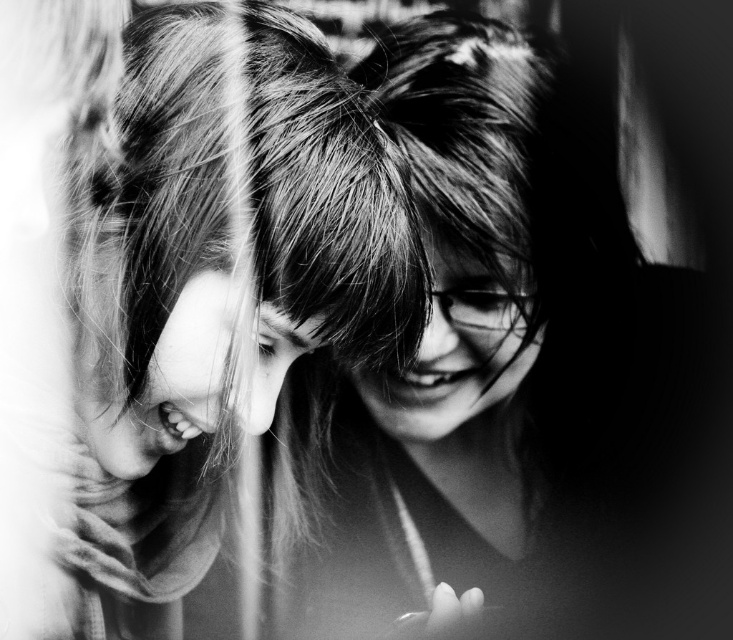
Question: Can you confirm if smooth hair at center is positioned above shiny hair at center?

Choices:
 (A) yes
 (B) no

Answer: (B)

Question: Is smooth hair at center to the left of shiny hair at center from the viewer's perspective?

Choices:
 (A) no
 (B) yes

Answer: (B)

Question: Does smooth hair at center appear over shiny hair at center?

Choices:
 (A) no
 (B) yes

Answer: (A)

Question: Which of the following is the farthest from the observer?

Choices:
 (A) smooth hair at center
 (B) shiny hair at center

Answer: (B)